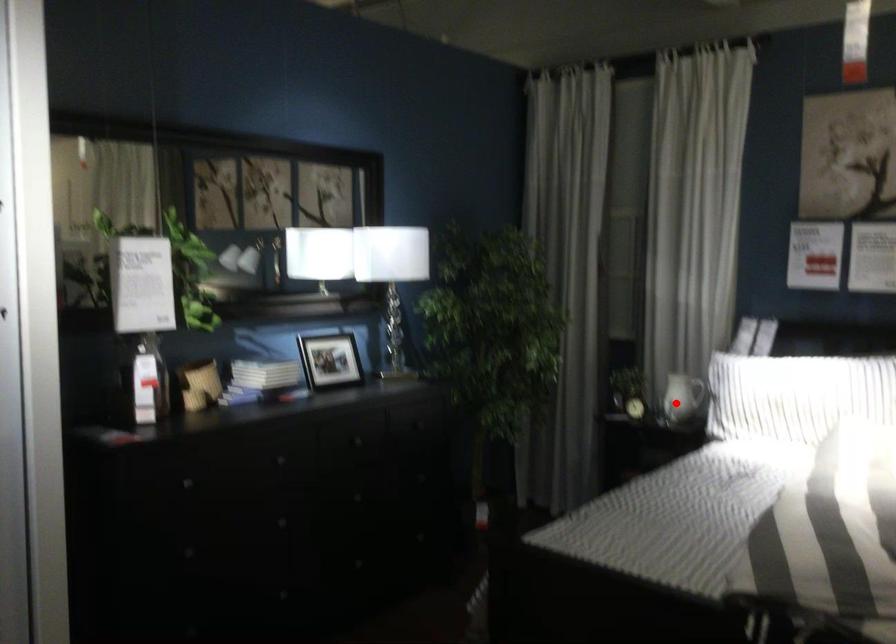
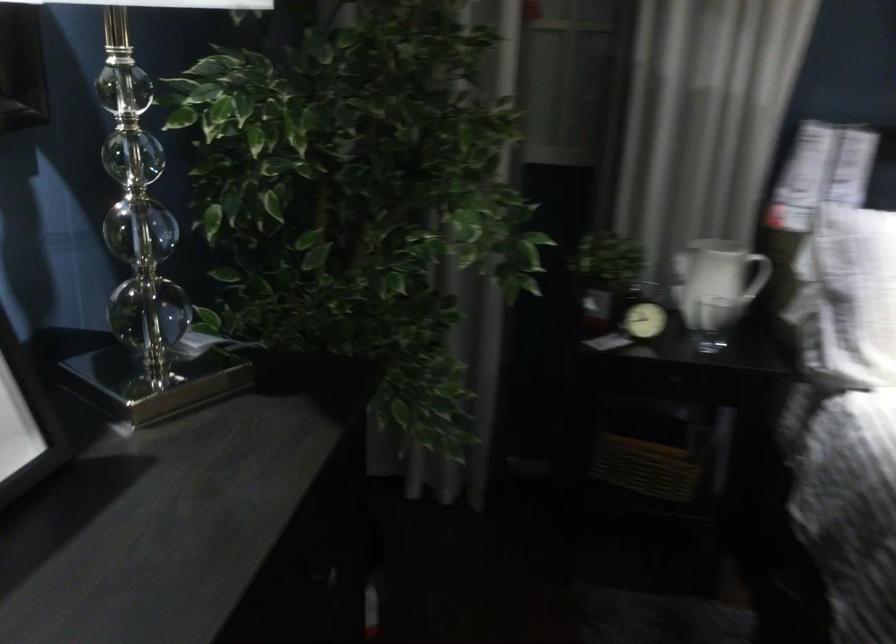
In the second image, find the point that corresponds to the highlighted location in the first image.

(713, 323)